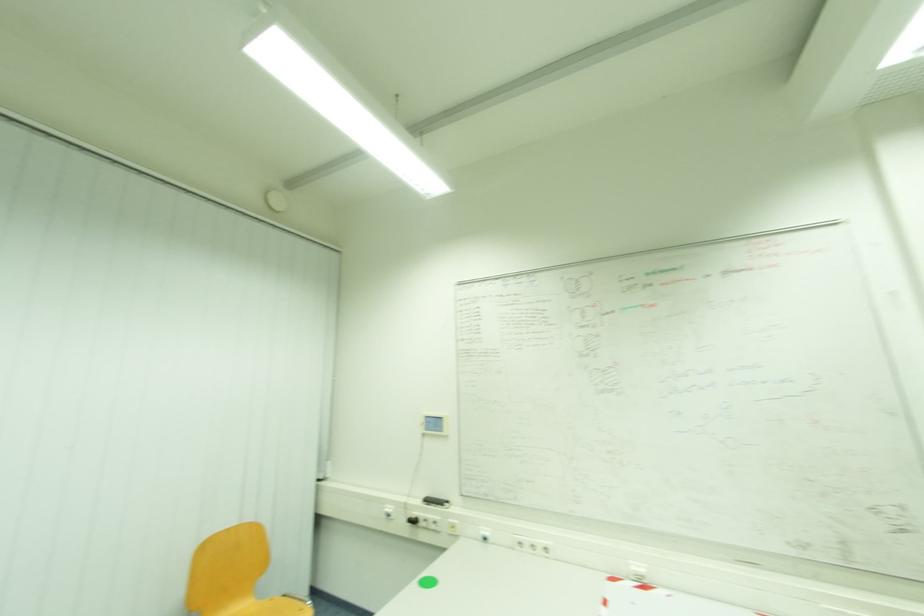
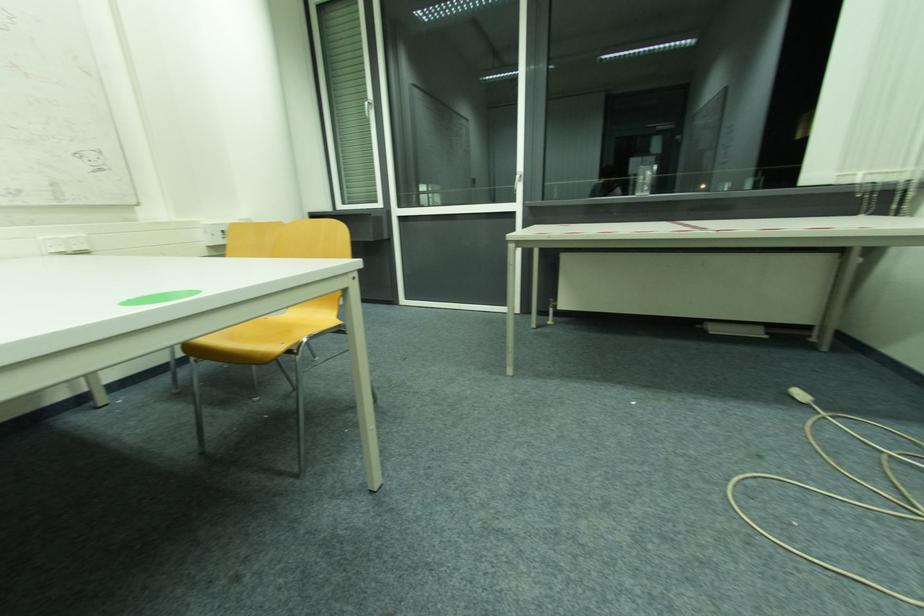
Question: The camera is either moving clockwise (left) or counter-clockwise (right) around the object. The first image is from the beginning of the video and the second image is from the end. Is the camera moving left or right when shooting the video?

Choices:
 (A) Left
 (B) Right

Answer: (A)